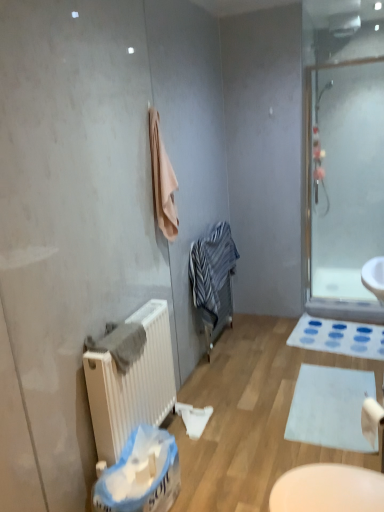
The width and height of the screenshot is (384, 512). I want to click on blank space above white matte radiator at lower left (from a real-world perspective), so click(x=126, y=320).